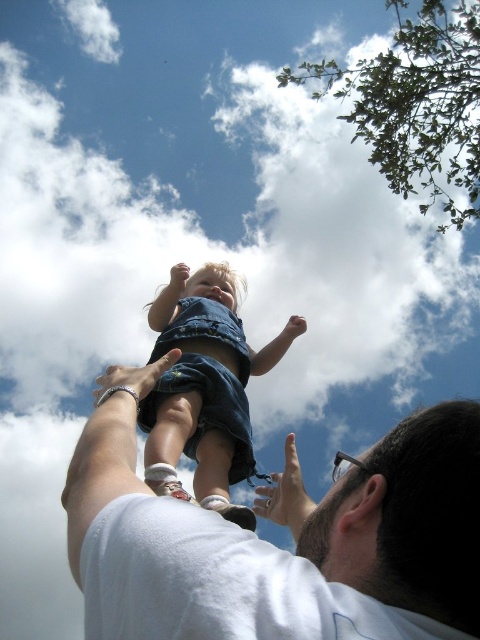
Which is below, white cotton shirt at upper center or matte skin hand at upper center?

white cotton shirt at upper center

What do you see at coordinates (275, 547) in the screenshot? This screenshot has width=480, height=640. I see `white cotton shirt at upper center` at bounding box center [275, 547].

Is point (374, 557) less distant than point (298, 332)?

Yes, it is.

You are a GUI agent. You are given a task and a screenshot of the screen. Output one action in this format:
    pyautogui.click(x=<x>, y=<y>)
    Task: Click on the white cotton shirt at upper center
    The image size is (480, 640).
    Given the screenshot: What is the action you would take?
    pyautogui.click(x=275, y=547)

Is denim shorts at center to the left of smooth skin hand at upper center from the viewer's perspective?

In fact, denim shorts at center is to the right of smooth skin hand at upper center.

Identify the location of denim shorts at center. The image size is (480, 640). (203, 390).

Locate an element on the screen. Image resolution: width=480 pixels, height=640 pixels. denim shorts at center is located at coordinates (203, 390).

Between denim shorts at center and matte skin hand at upper center, which one has more height?

denim shorts at center

Can you confirm if denim shorts at center is taller than matte skin hand at upper center?

Correct, denim shorts at center is much taller as matte skin hand at upper center.

Who is more distant from viewer, (x=263, y=371) or (x=298, y=336)?

Positioned behind is point (x=298, y=336).

The width and height of the screenshot is (480, 640). Find the location of `denim shorts at center`. denim shorts at center is located at coordinates (203, 390).